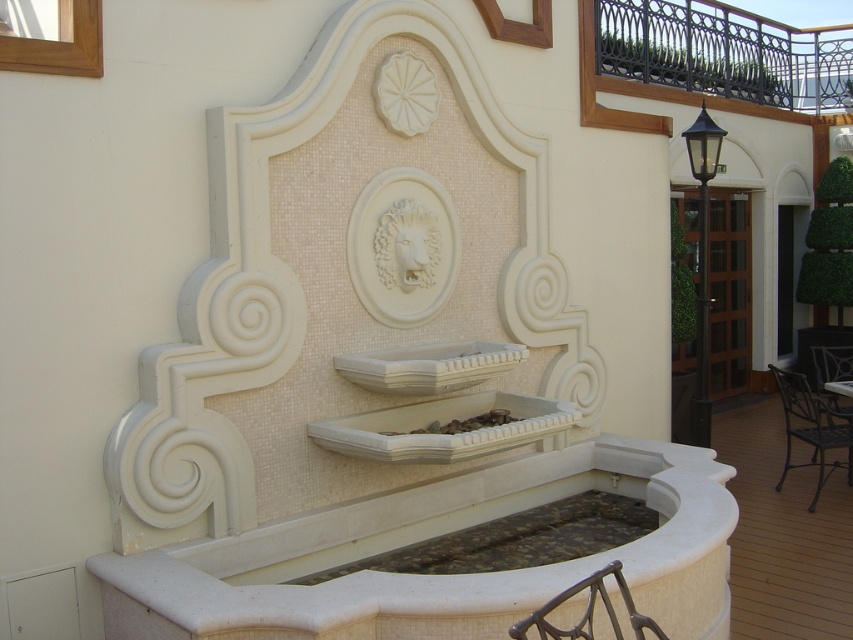
You are planning to place a large potted plant between the metallic dark brown chair at right and the metallic dark gray chair at right. Which chair should the plant be closer to if you want it to be near the bigger chair?

The metallic dark brown chair at right is larger than the metallic dark gray chair at right, so the plant should be placed closer to the metallic dark brown chair at right.

You are standing in front of the wall fountain and want to locate two specific points marked on the fountain. The first point is at coordinates point (817, 432) and the second is at point (825, 403). Which of these two points is closer to you?

Point (817, 432) is in front of point (825, 403), so it is closer to you.

You are standing at the center of the fountain and want to sit down. Is the metallic dark brown chair at right within your immediate vicinity?

The metallic dark brown chair at right is located at point (811, 428), which is relatively close to the center of the fountain. Therefore, it is within your immediate vicinity and you can easily reach it.